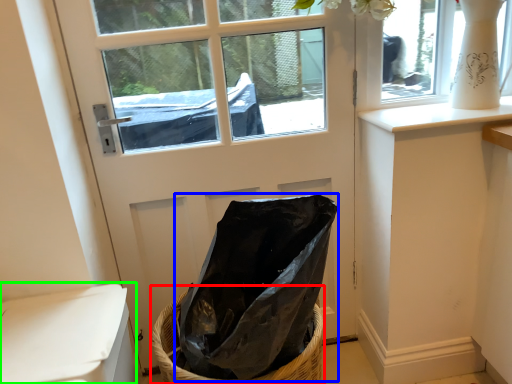
Question: Considering the real-world distances, which object is farthest from basket (highlighted by a red box)? bag (highlighted by a blue box) or armchair (highlighted by a green box)?

Choices:
 (A) bag
 (B) armchair

Answer: (B)